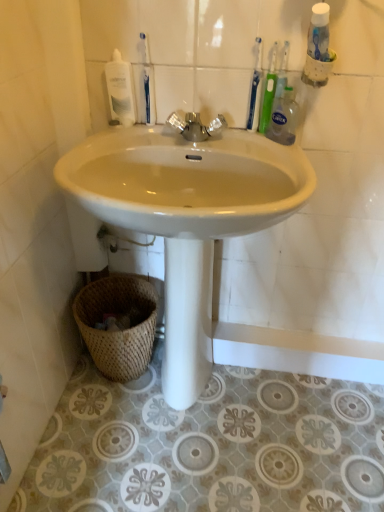
Locate an element on the screen. The image size is (384, 512). vacant area located to the right-hand side of blue plastic toothbrush at upper center, which appears as the third toothbrush when viewed from the right is located at coordinates (202, 138).